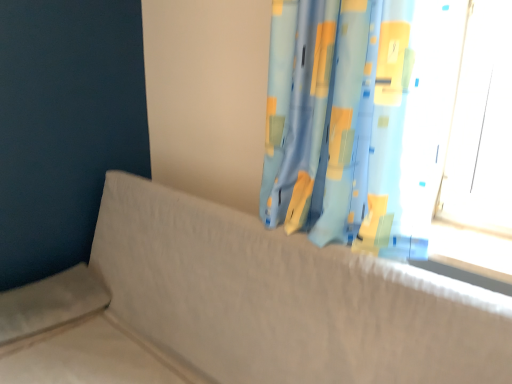
Question: In terms of width, does blue fabric curtain at upper right look wider or thinner when compared to textured beige couch at center?

Choices:
 (A) thin
 (B) wide

Answer: (A)

Question: Is point (327, 18) closer or farther from the camera than point (482, 326)?

Choices:
 (A) farther
 (B) closer

Answer: (A)

Question: In the image, is blue fabric curtain at upper right on the left side or the right side of textured beige couch at center?

Choices:
 (A) left
 (B) right

Answer: (B)

Question: Is textured beige couch at center to the left or to the right of blue fabric curtain at upper right in the image?

Choices:
 (A) right
 (B) left

Answer: (B)

Question: Considering the positions of textured beige couch at center and blue fabric curtain at upper right in the image, is textured beige couch at center wider or thinner than blue fabric curtain at upper right?

Choices:
 (A) thin
 (B) wide

Answer: (B)

Question: Do you think textured beige couch at center is within blue fabric curtain at upper right, or outside of it?

Choices:
 (A) outside
 (B) inside

Answer: (A)

Question: From a real-world perspective, is textured beige couch at center positioned above or below blue fabric curtain at upper right?

Choices:
 (A) above
 (B) below

Answer: (B)